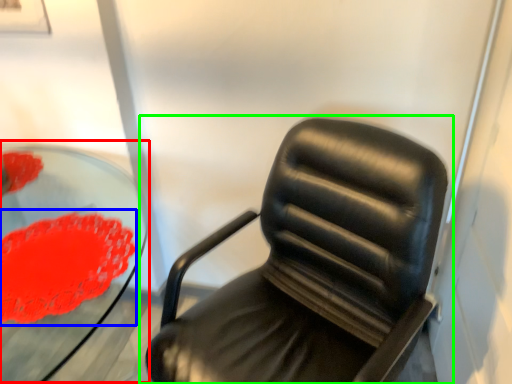
Question: Considering the real-world distances, which object is closest to round table (highlighted by a red box)? flower (highlighted by a blue box) or chair (highlighted by a green box).

Choices:
 (A) flower
 (B) chair

Answer: (A)